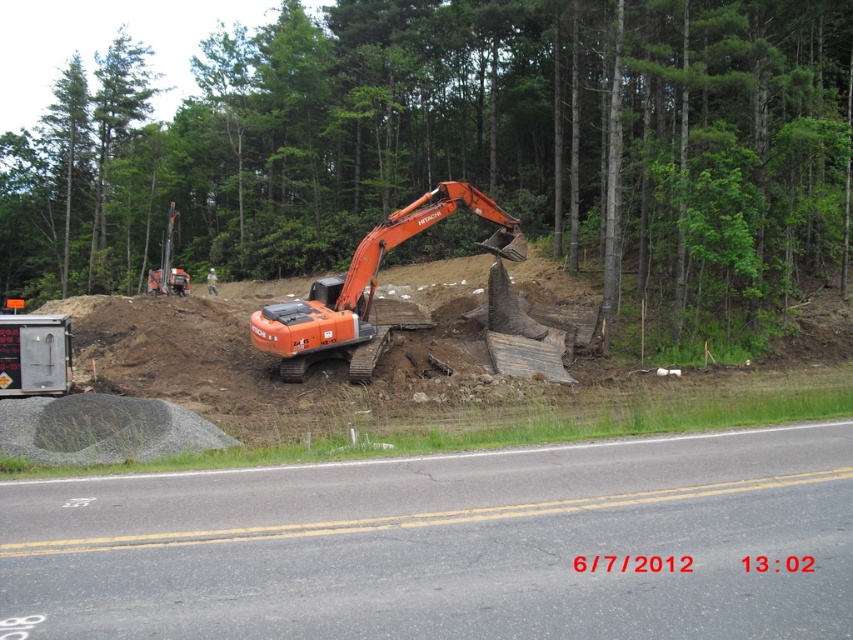
Who is taller, brushed metal trailer truck at lower left or blurred white helmet at center?

Standing taller between the two is blurred white helmet at center.

Locate an element on the screen. This screenshot has width=853, height=640. brushed metal trailer truck at lower left is located at coordinates 33,355.

Between black asphalt road at lower center and brushed metal trailer truck at lower left, which one is positioned lower?

Positioned lower is black asphalt road at lower center.

Does black asphalt road at lower center have a greater height compared to brushed metal trailer truck at lower left?

No.

Does point (560, 636) come in front of point (61, 384)?

Yes, point (560, 636) is in front of point (61, 384).

Locate an element on the screen. Image resolution: width=853 pixels, height=640 pixels. black asphalt road at lower center is located at coordinates (448, 545).

What do you see at coordinates (368, 288) in the screenshot? I see `orange rubber excavator at center` at bounding box center [368, 288].

Between orange rubber excavator at center and brushed metal trailer truck at lower left, which one has less height?

brushed metal trailer truck at lower left

Identify the location of orange rubber excavator at center. (368, 288).